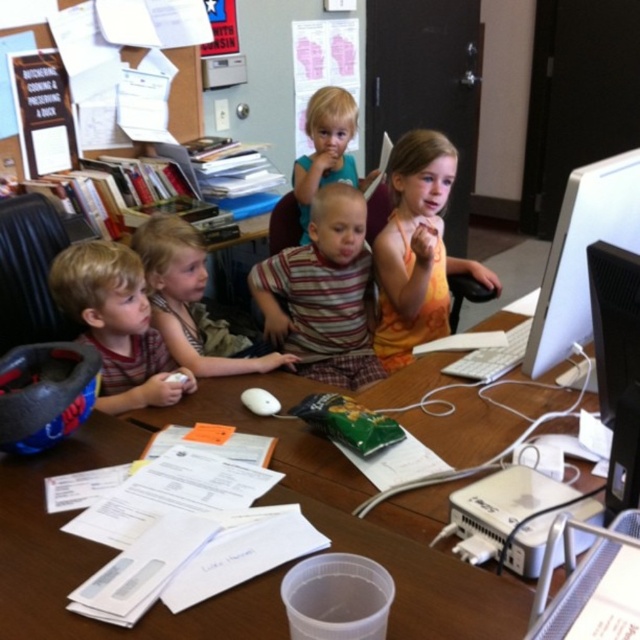
Question: Which of these objects is positioned farthest from the blonde hair at center?

Choices:
 (A) orange fabric dress at center
 (B) white matte mouse at center
 (C) clear plastic cup at center
 (D) white paper bulletin board at upper left

Answer: (D)

Question: Which point is farther from the camera taking this photo?

Choices:
 (A) (307, 208)
 (B) (445, 145)
 (C) (372, 317)

Answer: (A)

Question: Is orange fabric dress at center smaller than white matte mouse at center?

Choices:
 (A) yes
 (B) no

Answer: (B)

Question: Can you confirm if striped fabric shirt at center is thinner than matte red shirt at center?

Choices:
 (A) yes
 (B) no

Answer: (B)

Question: Which object is closer to the camera taking this photo?

Choices:
 (A) blonde hair at center
 (B) white glossy computer monitor at right
 (C) striped fabric shirt at center
 (D) matte red shirt at center

Answer: (B)

Question: Does striped fabric shirt at center have a greater width compared to blonde hair at upper center?

Choices:
 (A) no
 (B) yes

Answer: (B)